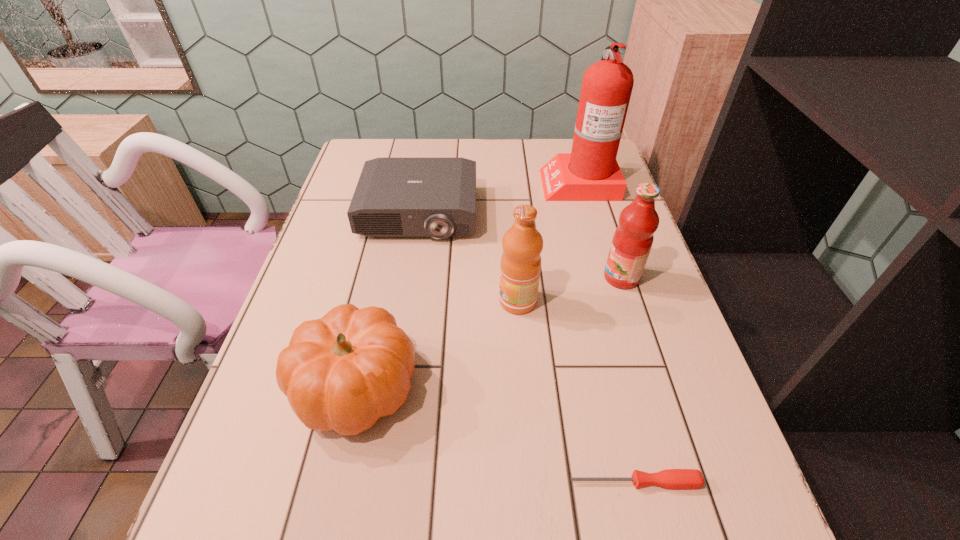
This screenshot has height=540, width=960. I want to click on fire extinguisher, so click(590, 172).

The image size is (960, 540). I want to click on the left fruit juice, so coord(520,266).

This screenshot has width=960, height=540. Find the location of `the right fruit juice`. the right fruit juice is located at coordinates (632, 241).

The height and width of the screenshot is (540, 960). Identify the location of pumpkin. (342, 372).

Find the location of a particular element. the fourth tallest object is located at coordinates (342, 372).

In order to click on projector in this screenshot , I will do `click(395, 197)`.

The height and width of the screenshot is (540, 960). I want to click on the shortest object, so click(669, 478).

Where is `the nearest object`? the nearest object is located at coordinates (669, 478).

Locate an element on the screen. This screenshot has height=540, width=960. free space located on the front-facing side of the tallest object is located at coordinates (516, 182).

Where is `vacant space situated 0.390m on the front-facing side of the tallest object`? Image resolution: width=960 pixels, height=540 pixels. vacant space situated 0.390m on the front-facing side of the tallest object is located at coordinates (414, 182).